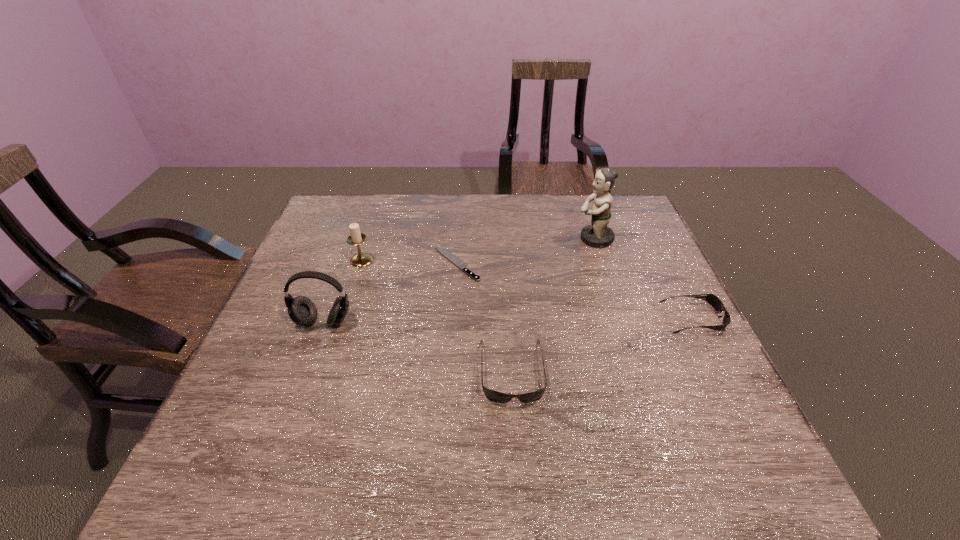
Considering the uniform spacing of sunglassess, where should an additional sunglasses be positioned on the left? Please locate a free spot. Please provide its 2D coordinates. Your answer should be formatted as a tuple, i.e. [(x, y)], where the tuple contains the x and y coordinates of a point satisfying the conditions above.

[(279, 438)]